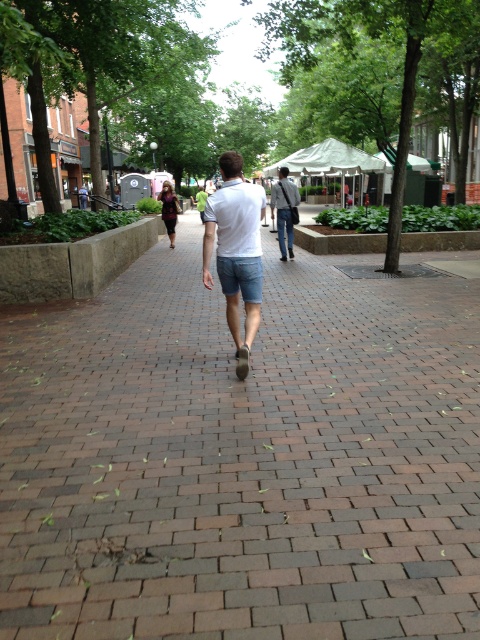
Does white cotton shirt at center lie in front of light blue denim shorts at center?

Yes, it is in front of light blue denim shorts at center.

Does white cotton shirt at center appear on the left side of light blue denim shorts at center?

Correct, you'll find white cotton shirt at center to the left of light blue denim shorts at center.

Measure the distance between point (211, 198) and camera.

They are 6.02 meters apart.

You are a GUI agent. You are given a task and a screenshot of the screen. Output one action in this format:
    pyautogui.click(x=<x>, y=<y>)
    Task: Click on the white cotton shirt at center
    The height and width of the screenshot is (640, 480).
    Given the screenshot: What is the action you would take?
    pyautogui.click(x=236, y=250)

Is brick pavement at center below light blue denim shorts at center?

Yes.

Is brick pavement at center taller than light blue denim shorts at center?

In fact, brick pavement at center may be shorter than light blue denim shorts at center.

Describe the element at coordinates (241, 458) in the screenshot. I see `brick pavement at center` at that location.

Identify the location of brick pavement at center. (241, 458).

Does brick pavement at center lie behind white cotton shirt at center?

No, it is not.

Image resolution: width=480 pixels, height=640 pixels. I want to click on brick pavement at center, so click(x=241, y=458).

Identify the location of brick pavement at center. (241, 458).